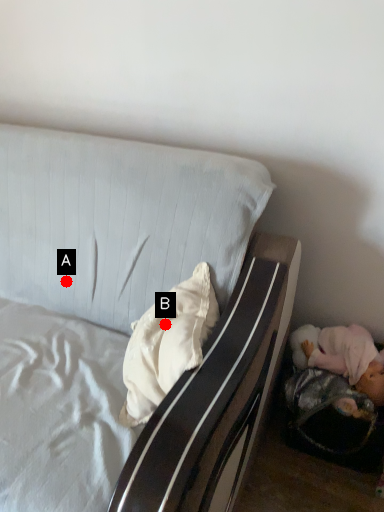
Question: Two points are circled on the image, labeled by A and B beside each circle. Among these points, which one is farthest from the camera?

Choices:
 (A) A is further
 (B) B is further

Answer: (A)